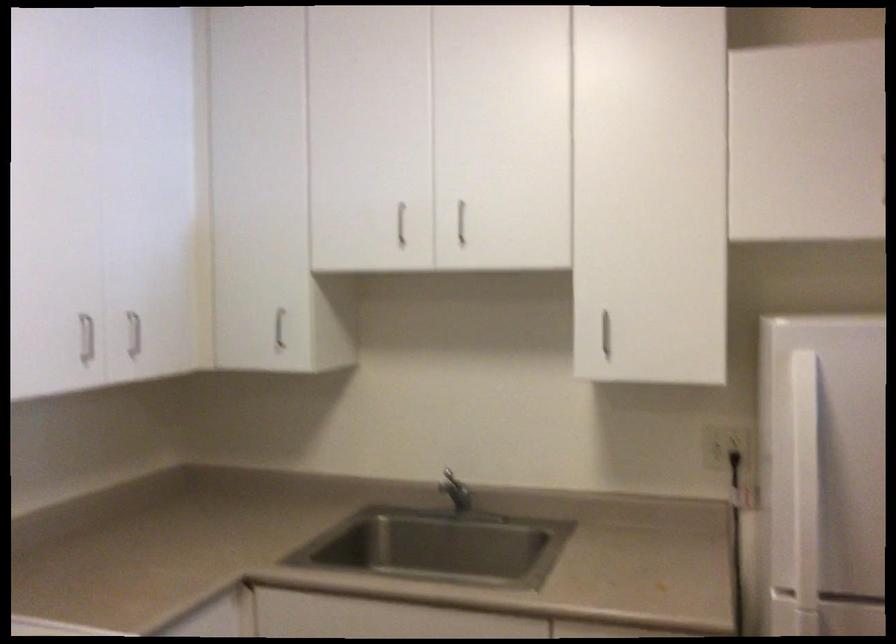
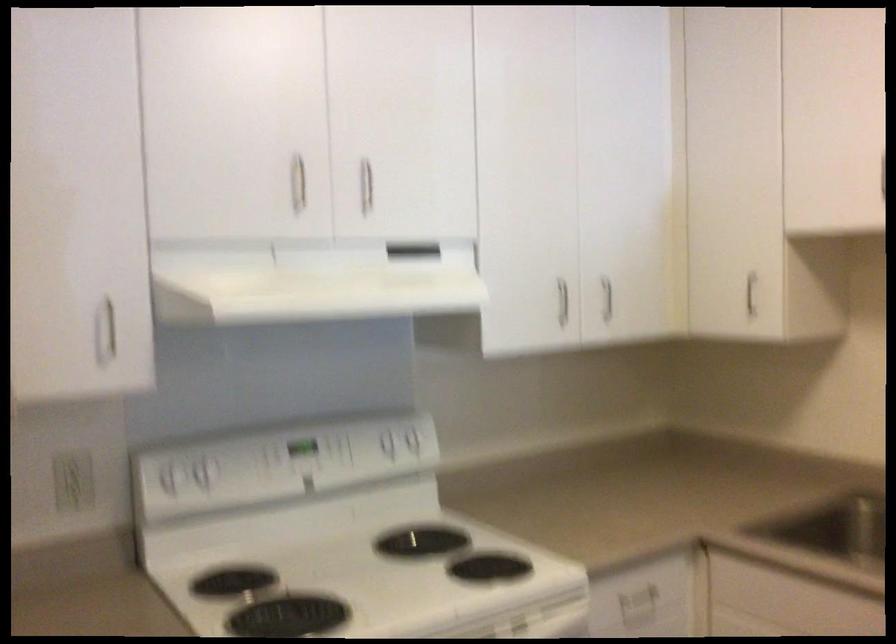
The point at (x=130, y=335) is marked in the first image. Where is the corresponding point in the second image?

(607, 298)